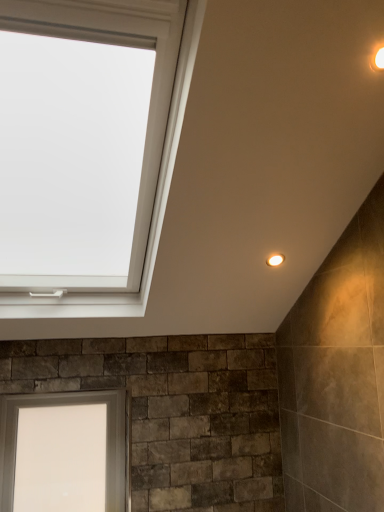
Question: From a real-world perspective, relative to white glass window at lower left, is warm matte light fixture at upper right, the second light fixture from the left, vertically above or below?

Choices:
 (A) above
 (B) below

Answer: (A)

Question: Does point (382, 66) appear closer or farther from the camera than point (112, 393)?

Choices:
 (A) closer
 (B) farther

Answer: (A)

Question: Which object is the closest to the white glass window at lower left?

Choices:
 (A) matte white light fixture at upper right, the first light fixture viewed from the left
 (B) warm matte light fixture at upper right, the second light fixture in the bottom-to-top sequence

Answer: (A)

Question: Which object is positioned farthest from the warm matte light fixture at upper right, the second light fixture when ordered from back to front?

Choices:
 (A) matte white light fixture at upper right, the first light fixture viewed from the left
 (B) white glass window at lower left

Answer: (B)